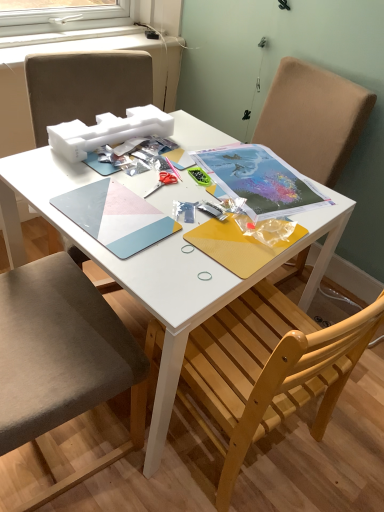
Where is `metallic silver scissors at center`? This screenshot has height=512, width=384. metallic silver scissors at center is located at coordinates (162, 182).

This screenshot has width=384, height=512. What do you see at coordinates (313, 119) in the screenshot?
I see `wooden chair at lower right, which is the 1th chair from right to left` at bounding box center [313, 119].

Describe the element at coordinates (260, 181) in the screenshot. I see `matte paper notebook at center, which is the second notebook from left to right` at that location.

At what (x,y) coordinates should I click in order to perform the action: click on matte plastic notebook at center, which ranks as the 1th notebook in left-to-right order. Please return your answer as a coordinate pair (x, y). Looking at the image, I should click on (115, 217).

Consider the image. What is the approximate width of matte plastic notebook at center, the 2th notebook when ordered from right to left?

matte plastic notebook at center, the 2th notebook when ordered from right to left, is 8.39 inches wide.

Locate an element on the screen. metallic silver scissors at center is located at coordinates (162, 182).

Is wooden chair at lower right, which is the 1th chair from right to left, positioned with its back to matte paper notebook at center, the 1th notebook from the right?

That's not correct — wooden chair at lower right, which is the 1th chair from right to left, is not looking away from matte paper notebook at center, the 1th notebook from the right.

Which is closer, (x=155, y=450) or (x=288, y=177)?

Point (x=155, y=450) is closer to the camera than point (x=288, y=177).

How many degrees apart are the facing directions of wooden chair at lower right, placed as the 2th chair when sorted from left to right, and matte paper notebook at center, which is the second notebook from left to right?

There is a 82.4-degree angle between the facing directions of wooden chair at lower right, placed as the 2th chair when sorted from left to right, and matte paper notebook at center, which is the second notebook from left to right.

Based on the photo, from the image's perspective, is wooden chair at lower right, placed as the 2th chair when sorted from left to right, over matte paper notebook at center, which is the second notebook from left to right?

No.

Does matte plastic notebook at center, the 2th notebook when ordered from right to left, have a smaller size compared to fabric cushioned chair at left, which appears as the second chair when viewed from the right?

Yes.

Would you say matte plastic notebook at center, the 2th notebook when ordered from right to left, is a long distance from fabric cushioned chair at left, which ranks as the first chair in left-to-right order?

No.

Is point (101, 220) closer or farther from the camera than point (90, 338)?

Point (101, 220) appears to be closer to the viewer than point (90, 338).

Does matte plastic notebook at center, the 2th notebook when ordered from right to left, appear on the right side of fabric cushioned chair at left, which appears as the second chair when viewed from the right?

Indeed, matte plastic notebook at center, the 2th notebook when ordered from right to left, is positioned on the right side of fabric cushioned chair at left, which appears as the second chair when viewed from the right.

Is fabric cushioned chair at left, which appears as the second chair when viewed from the right, positioned beyond the bounds of metallic silver scissors at center?

fabric cushioned chair at left, which appears as the second chair when viewed from the right, is positioned outside metallic silver scissors at center.

Are fabric cushioned chair at left, which appears as the second chair when viewed from the right, and metallic silver scissors at center beside each other?

They are not placed beside each other.

Which of these two, fabric cushioned chair at left, which appears as the second chair when viewed from the right, or metallic silver scissors at center, is wider?

fabric cushioned chair at left, which appears as the second chair when viewed from the right.

From a real-world perspective, is fabric cushioned chair at left, which appears as the second chair when viewed from the right, above or below metallic silver scissors at center?

fabric cushioned chair at left, which appears as the second chair when viewed from the right, is below metallic silver scissors at center.

Is fabric cushioned chair at left, which appears as the second chair when viewed from the right, oriented away from wooden chair at lower right, which is the 1th chair from right to left?

That's not correct — fabric cushioned chair at left, which appears as the second chair when viewed from the right, is not looking away from wooden chair at lower right, which is the 1th chair from right to left.

Can wooden chair at lower right, placed as the 2th chair when sorted from left to right, be found inside fabric cushioned chair at left, which appears as the second chair when viewed from the right?

No, wooden chair at lower right, placed as the 2th chair when sorted from left to right, is not surrounded by fabric cushioned chair at left, which appears as the second chair when viewed from the right.

Is fabric cushioned chair at left, which ranks as the first chair in left-to-right order, positioned in front of wooden chair at lower right, placed as the 2th chair when sorted from left to right?

That is True.

Identify the location of the 2nd chair below the metallic silver scissors at center (from the image's perspective). The width and height of the screenshot is (384, 512). (313, 119).

Would you say wooden chair at lower right, which is the 1th chair from right to left, contains metallic silver scissors at center?

No, metallic silver scissors at center is not a part of wooden chair at lower right, which is the 1th chair from right to left.

Does wooden chair at lower right, which is the 1th chair from right to left, have a lesser height compared to metallic silver scissors at center?

Incorrect, the height of wooden chair at lower right, which is the 1th chair from right to left, does not fall short of that of metallic silver scissors at center.

From a real-world perspective, is matte plastic notebook at center, which ranks as the 1th notebook in left-to-right order, below metallic silver scissors at center?

Incorrect, from a real-world perspective, matte plastic notebook at center, which ranks as the 1th notebook in left-to-right order, is higher than metallic silver scissors at center.

Is matte plastic notebook at center, which ranks as the 1th notebook in left-to-right order, oriented towards metallic silver scissors at center?

No.

From the image's perspective, would you say matte plastic notebook at center, the 2th notebook when ordered from right to left, is positioned over metallic silver scissors at center?

No, from the image's perspective, matte plastic notebook at center, the 2th notebook when ordered from right to left, is not on top of metallic silver scissors at center.

From their relative heights in the image, would you say matte plastic notebook at center, which ranks as the 1th notebook in left-to-right order, is taller or shorter than metallic silver scissors at center?

Considering their sizes, matte plastic notebook at center, which ranks as the 1th notebook in left-to-right order, has less height than metallic silver scissors at center.

Locate an element on the screen. The image size is (384, 512). scissors above the wooden chair at lower right, placed as the 2th chair when sorted from left to right (from the image's perspective) is located at coordinates (162, 182).

Is metallic silver scissors at center aimed at wooden chair at lower right, which is the 1th chair from right to left?

No, metallic silver scissors at center is not turned towards wooden chair at lower right, which is the 1th chair from right to left.

Is metallic silver scissors at center located outside wooden chair at lower right, which is the 1th chair from right to left?

metallic silver scissors at center is positioned outside wooden chair at lower right, which is the 1th chair from right to left.

Where is `the 2nd chair below the matte paper notebook at center, the 1th notebook from the right (from the image's perspective)`? This screenshot has height=512, width=384. the 2nd chair below the matte paper notebook at center, the 1th notebook from the right (from the image's perspective) is located at coordinates (313, 119).

From a real-world perspective, starting from the matte plastic notebook at center, which ranks as the 1th notebook in left-to-right order, which chair is the 1st one below it? Please provide its 2D coordinates.

[(58, 349)]

Estimate the real-world distances between objects in this image. Which object is closer to matte plastic notebook at center, the 2th notebook when ordered from right to left, metallic silver scissors at center or matte paper notebook at center, the 1th notebook from the right?

Among the two, metallic silver scissors at center is located nearer to matte plastic notebook at center, the 2th notebook when ordered from right to left.

Based on their spatial positions, is matte plastic notebook at center, which ranks as the 1th notebook in left-to-right order, or matte paper notebook at center, which is the second notebook from left to right, further from metallic silver scissors at center?

matte paper notebook at center, which is the second notebook from left to right.

From the image, which object appears to be farther from wooden chair at lower right, which is the 1th chair from right to left, matte paper notebook at center, the 1th notebook from the right, or matte plastic notebook at center, which ranks as the 1th notebook in left-to-right order?

matte plastic notebook at center, which ranks as the 1th notebook in left-to-right order, is further to wooden chair at lower right, which is the 1th chair from right to left.

When comparing their distances from matte plastic notebook at center, which ranks as the 1th notebook in left-to-right order, does fabric cushioned chair at left, which ranks as the first chair in left-to-right order, or wooden chair at lower right, placed as the 2th chair when sorted from left to right, seem closer?

fabric cushioned chair at left, which ranks as the first chair in left-to-right order, is positioned closer to the anchor matte plastic notebook at center, which ranks as the 1th notebook in left-to-right order.

Considering their positions, is wooden chair at lower right, placed as the 2th chair when sorted from left to right, positioned further to matte plastic notebook at center, the 2th notebook when ordered from right to left, than fabric cushioned chair at left, which appears as the second chair when viewed from the right?

wooden chair at lower right, placed as the 2th chair when sorted from left to right.

Consider the image. Based on their spatial positions, is wooden chair at lower right, which is the 1th chair from right to left, or fabric cushioned chair at left, which appears as the second chair when viewed from the right, closer to matte paper notebook at center, the 1th notebook from the right?

wooden chair at lower right, which is the 1th chair from right to left, lies closer to matte paper notebook at center, the 1th notebook from the right, than the other object.

From the image, which object appears to be nearer to matte paper notebook at center, which is the second notebook from left to right, metallic silver scissors at center or matte plastic notebook at center, the 2th notebook when ordered from right to left?

metallic silver scissors at center lies closer to matte paper notebook at center, which is the second notebook from left to right, than the other object.

Which object lies further to the anchor point metallic silver scissors at center, matte paper notebook at center, which is the second notebook from left to right, or fabric cushioned chair at left, which appears as the second chair when viewed from the right?

The object further to metallic silver scissors at center is fabric cushioned chair at left, which appears as the second chair when viewed from the right.

Where is `scissors between matte plastic notebook at center, which ranks as the 1th notebook in left-to-right order, and matte paper notebook at center, which is the second notebook from left to right, from left to right`? Image resolution: width=384 pixels, height=512 pixels. scissors between matte plastic notebook at center, which ranks as the 1th notebook in left-to-right order, and matte paper notebook at center, which is the second notebook from left to right, from left to right is located at coordinates (162, 182).

Where is `notebook between fabric cushioned chair at left, which ranks as the first chair in left-to-right order, and wooden chair at lower right, placed as the 2th chair when sorted from left to right`? The width and height of the screenshot is (384, 512). notebook between fabric cushioned chair at left, which ranks as the first chair in left-to-right order, and wooden chair at lower right, placed as the 2th chair when sorted from left to right is located at coordinates (115, 217).

This screenshot has height=512, width=384. What are the coordinates of `chair positioned between fabric cushioned chair at left, which ranks as the first chair in left-to-right order, and metallic silver scissors at center from near to far` in the screenshot? It's located at (313, 119).

Find the location of `notebook between fabric cushioned chair at left, which ranks as the first chair in left-to-right order, and matte paper notebook at center, the 1th notebook from the right`. notebook between fabric cushioned chair at left, which ranks as the first chair in left-to-right order, and matte paper notebook at center, the 1th notebook from the right is located at coordinates (115, 217).